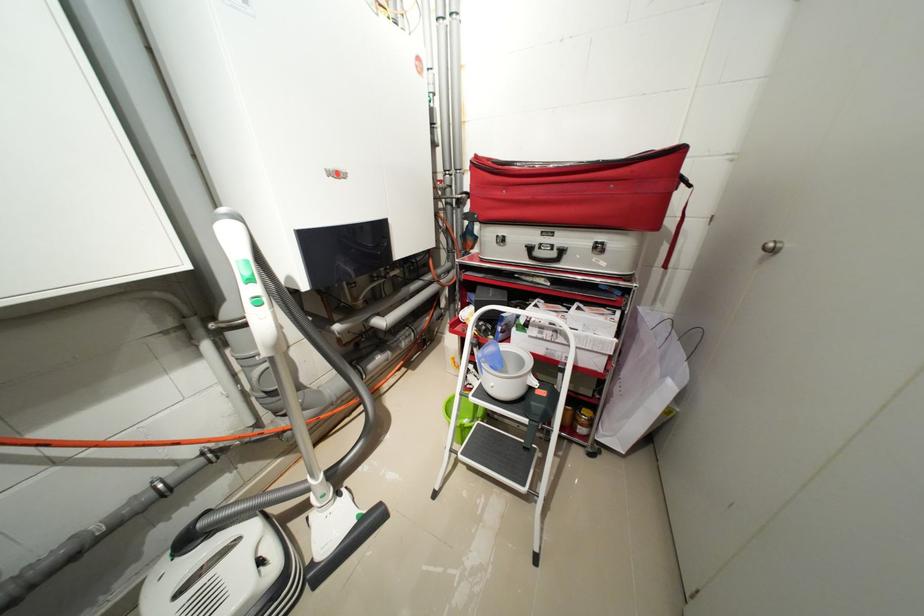
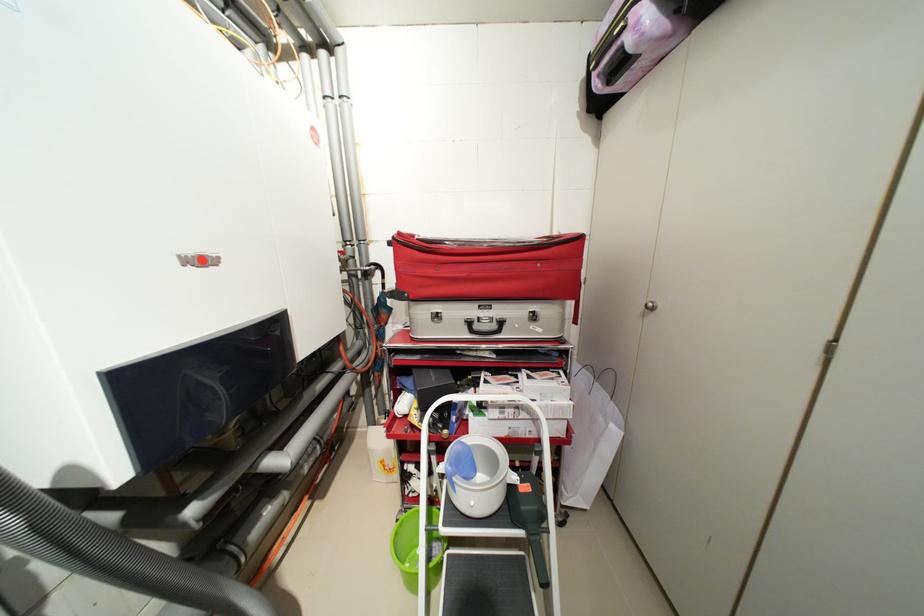
Where in the second image is the point corresponding to point (278, 286) from the first image?

(19, 523)